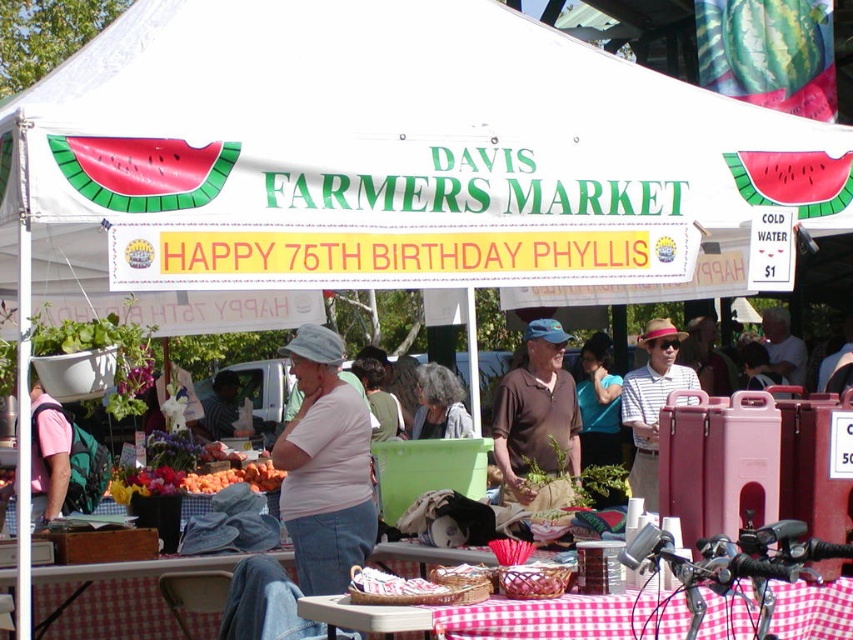
You are standing at the Davis Farmers Market and want to take a photo of the point located at coordinates (367, 40). If your camera has a maximum focus range of 7 meters, will you be able to focus on that point?

The distance of point (367, 40) from viewer is 7.58 meters, which exceeds the camera maximum focus range of 7 meters. Therefore, the camera cannot focus on that point.

You are a customer at the Davis Farmers Market. You see the white fabric canopy at upper center and the checkered fabric tablecloth at lower center. Which object is higher in height?

The white fabric canopy at upper center is taller than the checkered fabric tablecloth at lower center.